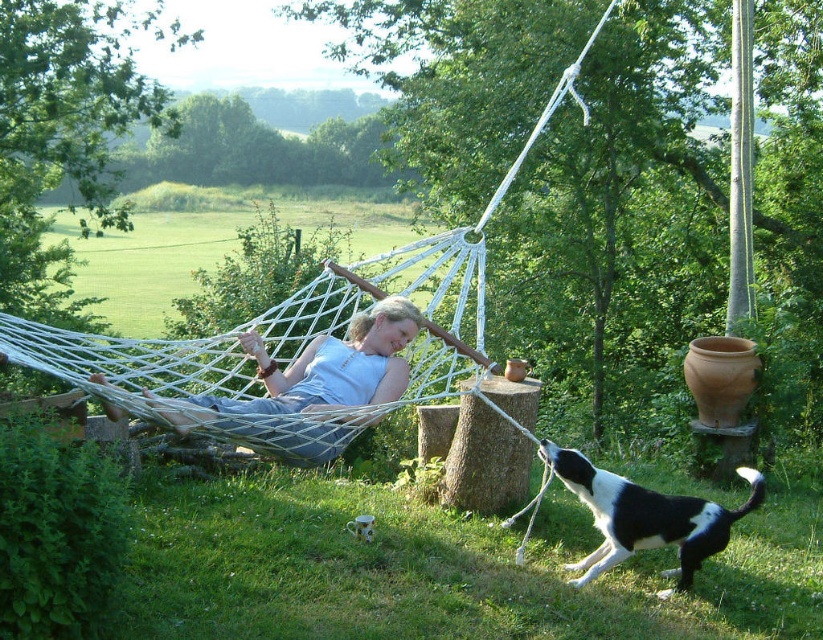
Question: Does white rope hammock at center have a lesser width compared to black and white fur dog at lower right?

Choices:
 (A) no
 (B) yes

Answer: (A)

Question: Which object is positioned closest to the white cotton hammock at center?

Choices:
 (A) black and white fur dog at lower right
 (B) white rope hammock at center

Answer: (B)

Question: Among these objects, which one is nearest to the camera?

Choices:
 (A) black and white fur dog at lower right
 (B) white cotton hammock at center
 (C) white rope hammock at center

Answer: (C)

Question: Which object is farther from the camera taking this photo?

Choices:
 (A) white cotton hammock at center
 (B) white rope hammock at center

Answer: (A)

Question: Is white rope hammock at center thinner than white cotton hammock at center?

Choices:
 (A) no
 (B) yes

Answer: (B)

Question: Where is white rope hammock at center located in relation to black and white fur dog at lower right in the image?

Choices:
 (A) left
 (B) right

Answer: (A)